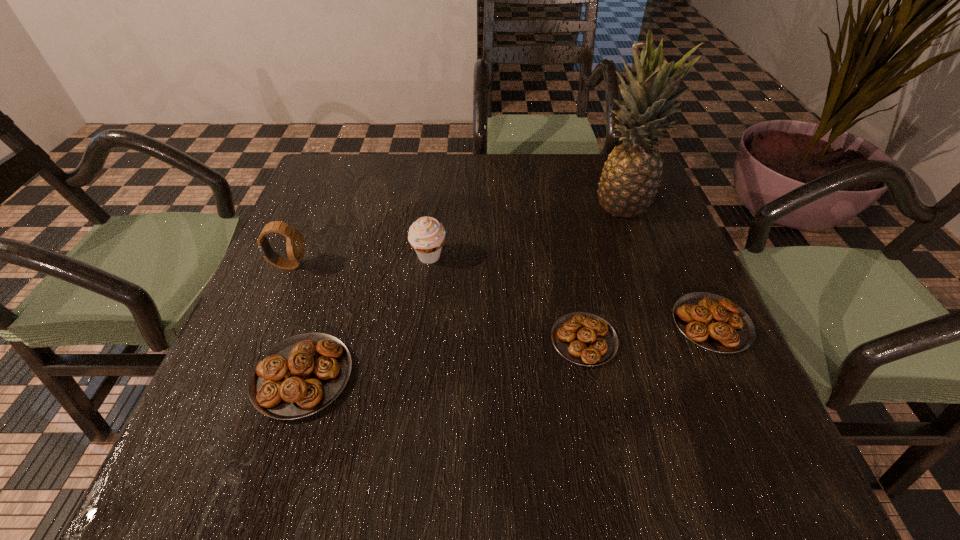
Point out which pastry is positioned as the second nearest to the second tallest pastry. Please provide its 2D coordinates. Your answer should be formatted as a tuple, i.e. [(x, y)], where the tuple contains the x and y coordinates of a point satisfying the conditions above.

[(299, 376)]

You are a GUI agent. You are given a task and a screenshot of the screen. Output one action in this format:
    pyautogui.click(x=<x>, y=<y>)
    Task: Click on the free space that satisfies the following two spatial constraints: 1. on the face of the shortest pastry; 2. on the right side of the watch
    
    Given the screenshot: What is the action you would take?
    pyautogui.click(x=256, y=340)

This screenshot has height=540, width=960. I want to click on free spot that satisfies the following two spatial constraints: 1. on the face of the watch; 2. on the left side of the third object from right to left, so click(256, 340).

The image size is (960, 540). In order to click on vacant region that satisfies the following two spatial constraints: 1. on the face of the watch; 2. on the left side of the rightmost pastry in this screenshot , I will do point(263,323).

Where is `vacant space that satisfies the following two spatial constraints: 1. on the back side of the second pastry from right to left; 2. on the face of the watch`? This screenshot has height=540, width=960. vacant space that satisfies the following two spatial constraints: 1. on the back side of the second pastry from right to left; 2. on the face of the watch is located at coordinates (569, 265).

Find the location of a particular element. The image size is (960, 540). free location that satisfies the following two spatial constraints: 1. on the face of the watch; 2. on the back side of the shortest object is located at coordinates (256, 340).